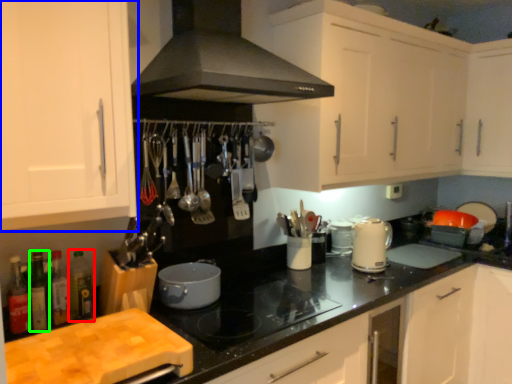
Question: Which object is positioned closest to bottle (highlighted by a red box)? Select from cabinetry (highlighted by a blue box) and bottle (highlighted by a green box).

Choices:
 (A) cabinetry
 (B) bottle

Answer: (B)